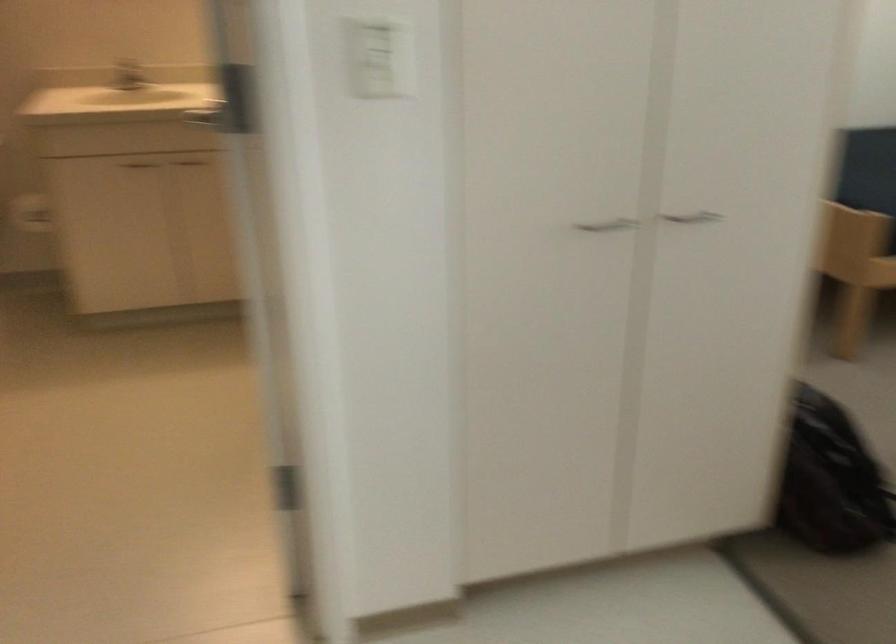
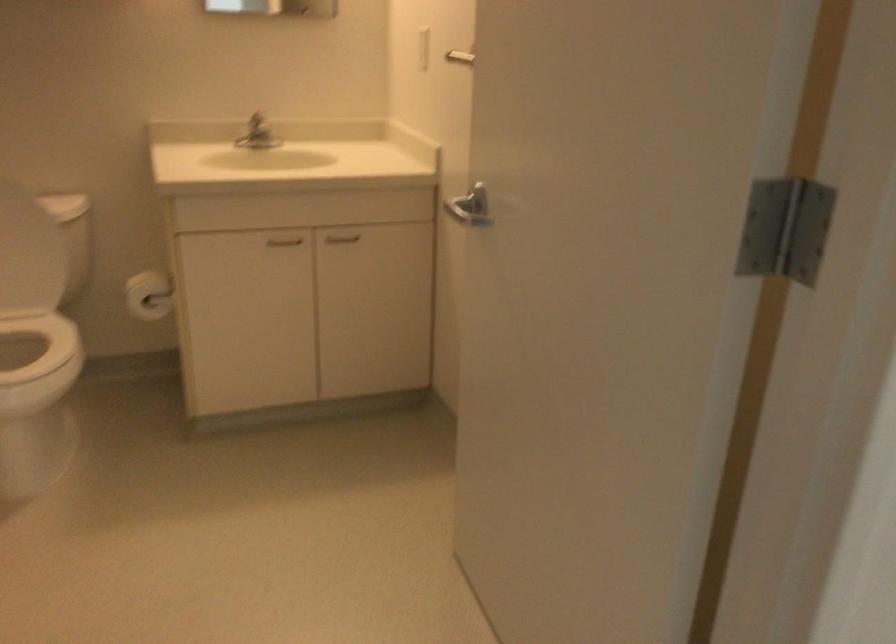
Locate, in the second image, the point that corresponds to the point at 135,165 in the first image.

(283, 241)